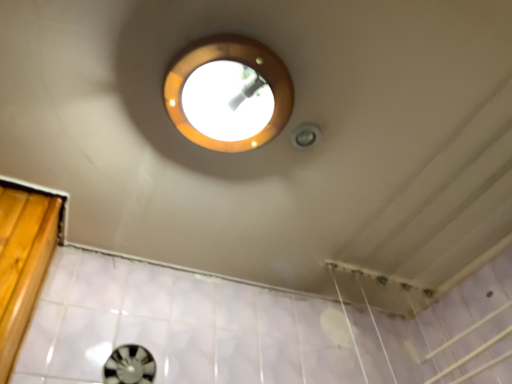
Question: Considering the relative positions of black plastic porthole at lower left and matte gold light fixture at upper center in the image provided, is black plastic porthole at lower left to the right of matte gold light fixture at upper center from the viewer's perspective?

Choices:
 (A) no
 (B) yes

Answer: (A)

Question: Is black plastic porthole at lower left far away from matte gold light fixture at upper center?

Choices:
 (A) no
 (B) yes

Answer: (A)

Question: Considering the relative sizes of black plastic porthole at lower left and matte gold light fixture at upper center in the image provided, is black plastic porthole at lower left thinner than matte gold light fixture at upper center?

Choices:
 (A) no
 (B) yes

Answer: (B)

Question: Does black plastic porthole at lower left turn towards matte gold light fixture at upper center?

Choices:
 (A) yes
 (B) no

Answer: (A)

Question: Is black plastic porthole at lower left bigger than matte gold light fixture at upper center?

Choices:
 (A) yes
 (B) no

Answer: (B)

Question: Does black plastic porthole at lower left lie in front of matte gold light fixture at upper center?

Choices:
 (A) yes
 (B) no

Answer: (B)

Question: From a real-world perspective, does matte gold light fixture at upper center sit lower than black plastic porthole at lower left?

Choices:
 (A) yes
 (B) no

Answer: (B)

Question: From a real-world perspective, is matte gold light fixture at upper center located higher than black plastic porthole at lower left?

Choices:
 (A) no
 (B) yes

Answer: (B)

Question: Is matte gold light fixture at upper center at the left side of black plastic porthole at lower left?

Choices:
 (A) no
 (B) yes

Answer: (A)

Question: Does matte gold light fixture at upper center come behind black plastic porthole at lower left?

Choices:
 (A) no
 (B) yes

Answer: (A)

Question: Is matte gold light fixture at upper center closer to the viewer compared to black plastic porthole at lower left?

Choices:
 (A) yes
 (B) no

Answer: (A)

Question: Considering the relative sizes of matte gold light fixture at upper center and black plastic porthole at lower left in the image provided, is matte gold light fixture at upper center shorter than black plastic porthole at lower left?

Choices:
 (A) no
 (B) yes

Answer: (B)

Question: Is matte gold light fixture at upper center taller or shorter than black plastic porthole at lower left?

Choices:
 (A) tall
 (B) short

Answer: (B)